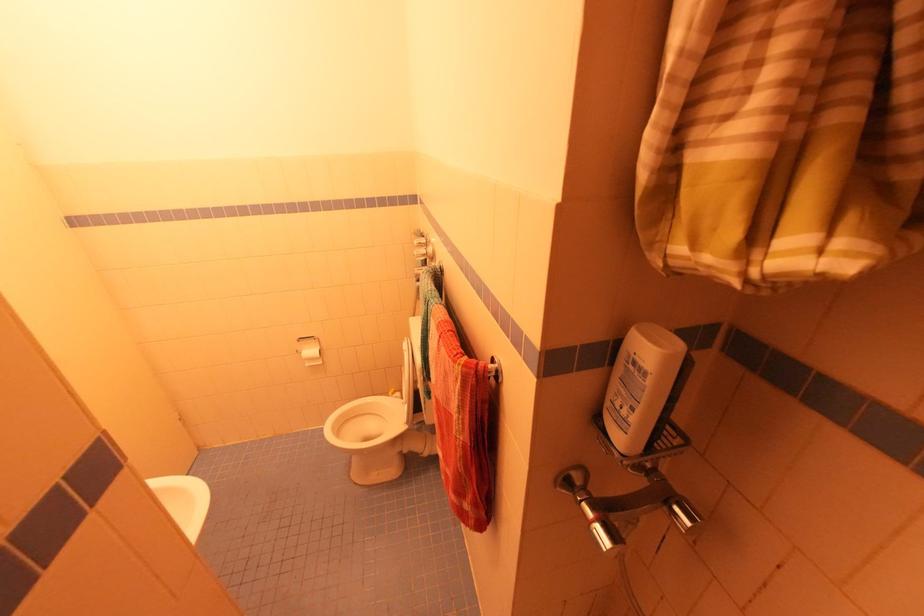
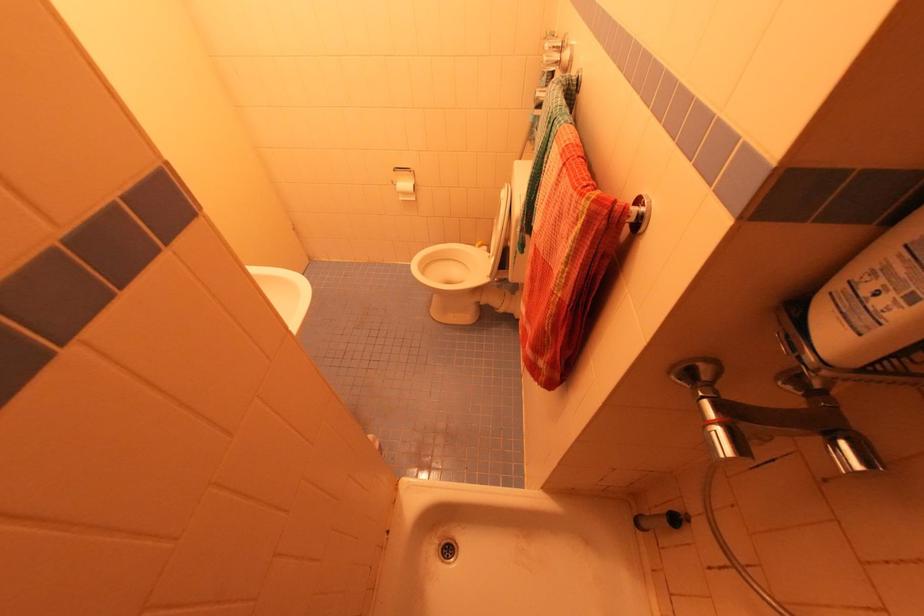
Question: How did the camera likely rotate?

Choices:
 (A) Left
 (B) Right
 (C) Up
 (D) Down

Answer: (D)